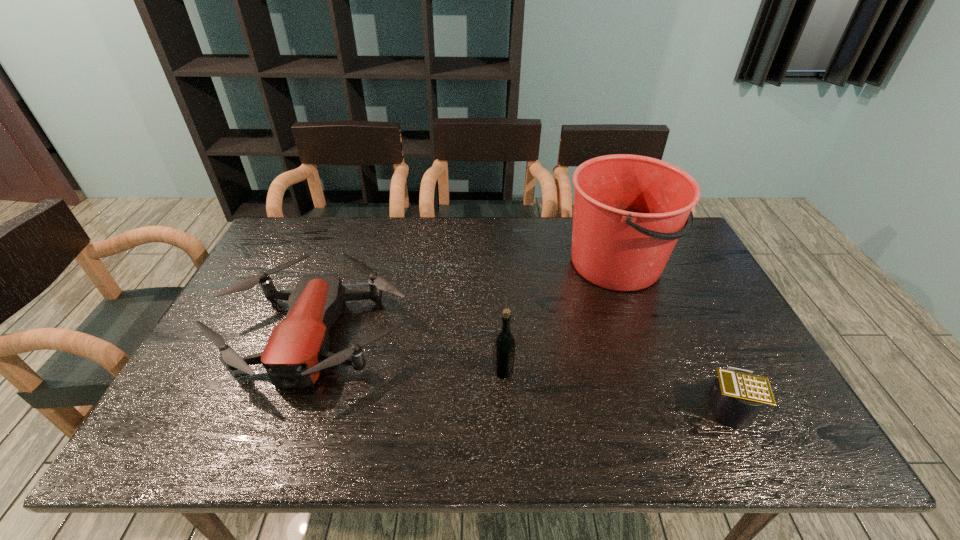
At what (x,y) coordinates should I click in order to perform the action: click on object located at the near edge. Please return your answer as a coordinate pair (x, y). This screenshot has height=540, width=960. Looking at the image, I should click on (738, 396).

This screenshot has width=960, height=540. What are the coordinates of `object that is at the left edge` in the screenshot? It's located at (297, 350).

Find the location of a particular element. bucket that is at the right edge is located at coordinates (629, 211).

The height and width of the screenshot is (540, 960). What are the coordinates of `calculator that is at the right edge` in the screenshot? It's located at (738, 396).

In order to click on object present at the far right corner in this screenshot , I will do `click(629, 211)`.

Locate an element on the screen. The height and width of the screenshot is (540, 960). object at the near right corner is located at coordinates (738, 396).

Where is `free region at the far edge of the desktop`? The height and width of the screenshot is (540, 960). free region at the far edge of the desktop is located at coordinates [320, 255].

The image size is (960, 540). Find the location of `blank space at the near edge of the desktop`. blank space at the near edge of the desktop is located at coordinates (645, 427).

Locate an element on the screen. The image size is (960, 540). vacant space at the left edge of the desktop is located at coordinates (202, 407).

The image size is (960, 540). In order to click on vacant space at the right edge in this screenshot , I will do `click(684, 301)`.